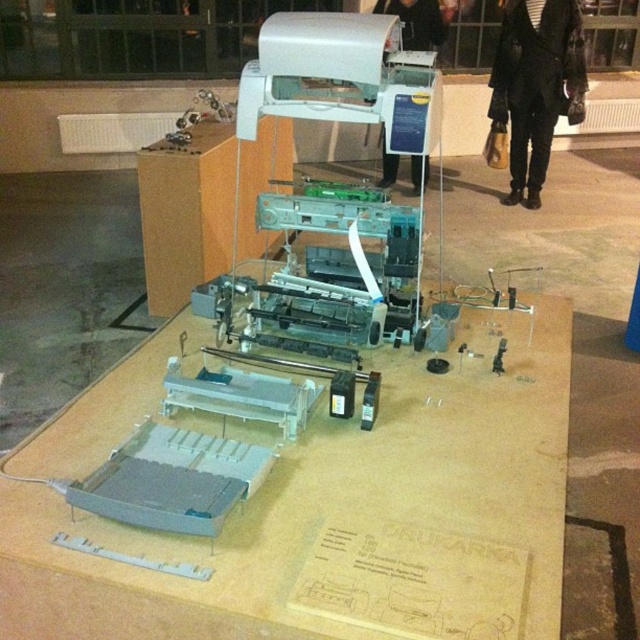
This screenshot has height=640, width=640. What do you see at coordinates (333, 504) in the screenshot?
I see `matte gray plastic table at center` at bounding box center [333, 504].

Is matte gray plastic table at center further to the viewer compared to white plastic printer at upper center?

No, matte gray plastic table at center is closer to the viewer.

Between point (371, 496) and point (284, 68), which one is positioned in front?

Positioned in front is point (371, 496).

You are a GUI agent. You are given a task and a screenshot of the screen. Output one action in this format:
    pyautogui.click(x=<x>, y=<y>)
    Task: Click on the matte gray plastic table at center
    The height and width of the screenshot is (640, 640).
    Given the screenshot: What is the action you would take?
    pyautogui.click(x=333, y=504)

Looking at this image, does matte gray plastic table at center appear on the right side of matte plastic table at center?

Yes, matte gray plastic table at center is to the right of matte plastic table at center.

Between matte gray plastic table at center and matte plastic table at center, which one appears on the right side from the viewer's perspective?

matte gray plastic table at center is more to the right.

Is point (316, 412) more distant than point (214, 154)?

No, (316, 412) is in front of (214, 154).

Locate an element on the screen. This screenshot has width=640, height=640. matte gray plastic table at center is located at coordinates (333, 504).

Is point (323, 36) less distant than point (259, 148)?

That is True.

Is white plastic printer at upper center shorter than matte plastic table at center?

Yes, white plastic printer at upper center is shorter than matte plastic table at center.

Does point (250, 99) lie in front of point (212, 186)?

Yes, point (250, 99) is in front of point (212, 186).

You are a GUI agent. You are given a task and a screenshot of the screen. Output one action in this format:
    pyautogui.click(x=<x>, y=<y>)
    Task: Click on the white plastic printer at upper center
    This screenshot has width=640, height=640.
    Given the screenshot: What is the action you would take?
    pyautogui.click(x=340, y=76)